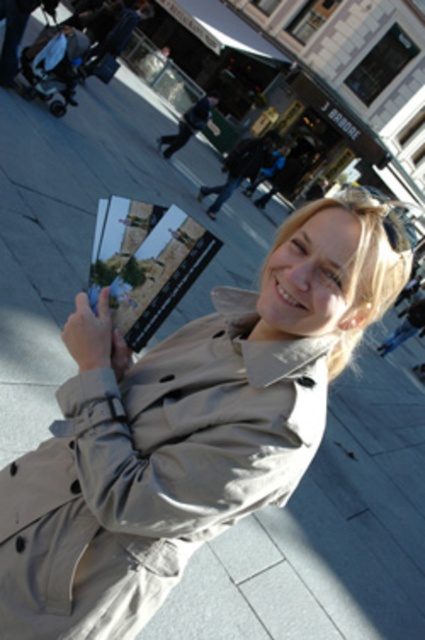
Based on the photo, you are a photographer trying to capture the person in the beige trench coat at center. The focus point of your camera is currently at point (153, 472). Will this point be on the person?

Yes, the point (153, 472) is on the light beige trench coat at center, so the focus point will be on the person.

You are a photographer trying to capture the light beige trench coat at center without the matte gray phone at lower left appearing in the frame. Based on their positions, is this achievable?

The light beige trench coat at center is positioned under the matte gray phone at lower left, so adjusting the camera angle upward might allow capturing the coat without the phone obstructing the view.

You are a photographer trying to capture the light beige trench coat at center in your shot. The camera is set to focus at point coordinates 0.738, 0.362. Will the coat be in focus?

Yes, the light beige trench coat at center is exactly at point (153, 472), so it will be in focus.